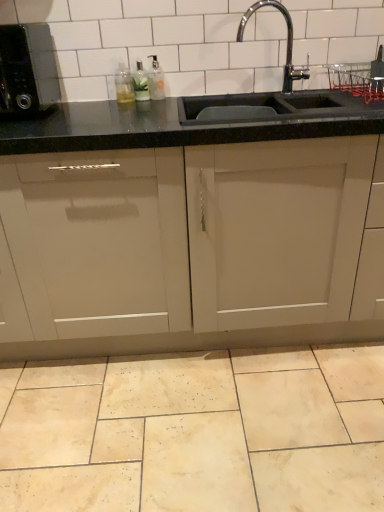
The image size is (384, 512). In order to click on free space to the right of clear glass bottle at upper center, the third bottle in the left-to-right sequence in this screenshot , I will do `click(190, 99)`.